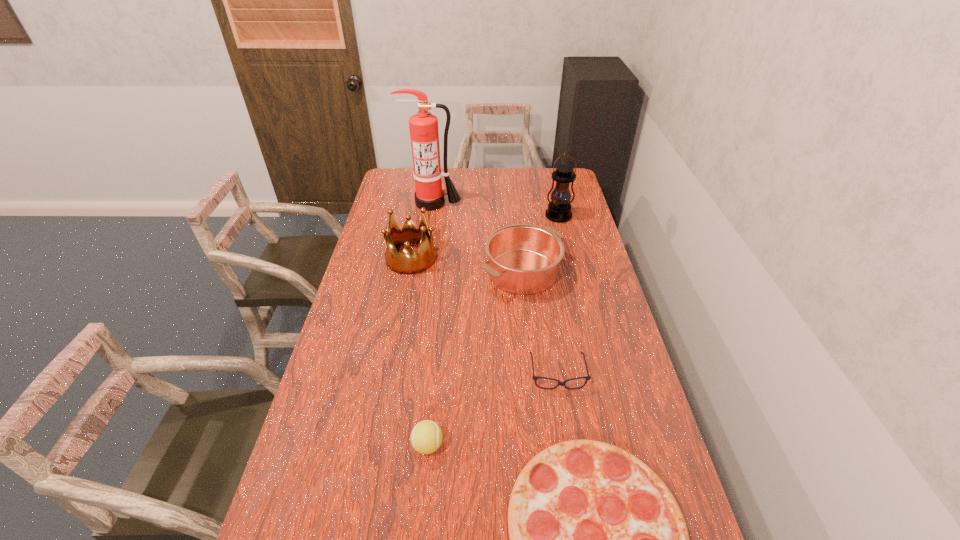
Where is `object that is the closest to the fire extinguisher`? Image resolution: width=960 pixels, height=540 pixels. object that is the closest to the fire extinguisher is located at coordinates (408, 262).

At what (x,y) coordinates should I click in order to perform the action: click on object identified as the sixth closest to the second shortest object. Please return your answer as a coordinate pair (x, y). The height and width of the screenshot is (540, 960). Looking at the image, I should click on (424, 134).

Identify the location of free space that satisfies the following two spatial constraints: 1. on the front side of the third tallest object; 2. on the right side of the saucepan. The height and width of the screenshot is (540, 960). (408, 272).

The height and width of the screenshot is (540, 960). Find the location of `vacant space that satisfies the following two spatial constraints: 1. at the nozzle of the tallest object; 2. on the right side of the tennis ball`. vacant space that satisfies the following two spatial constraints: 1. at the nozzle of the tallest object; 2. on the right side of the tennis ball is located at coordinates (396, 446).